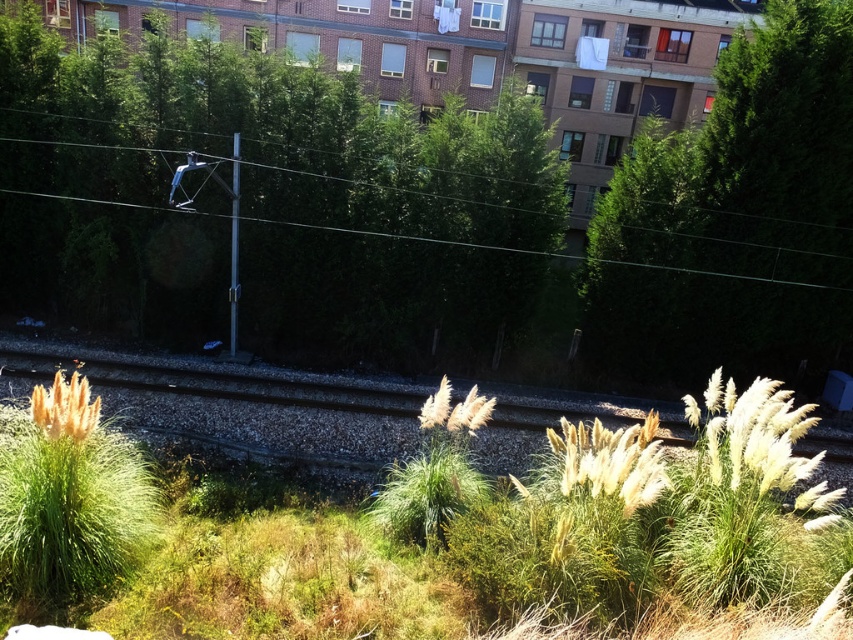
Between point (193, 77) and point (822, 141), which one is positioned behind?

Positioned behind is point (193, 77).

Who is more forward, (306, 262) or (755, 68)?

Positioned in front is point (755, 68).

Where is `green leafy tree at center`? The width and height of the screenshot is (853, 640). green leafy tree at center is located at coordinates (305, 188).